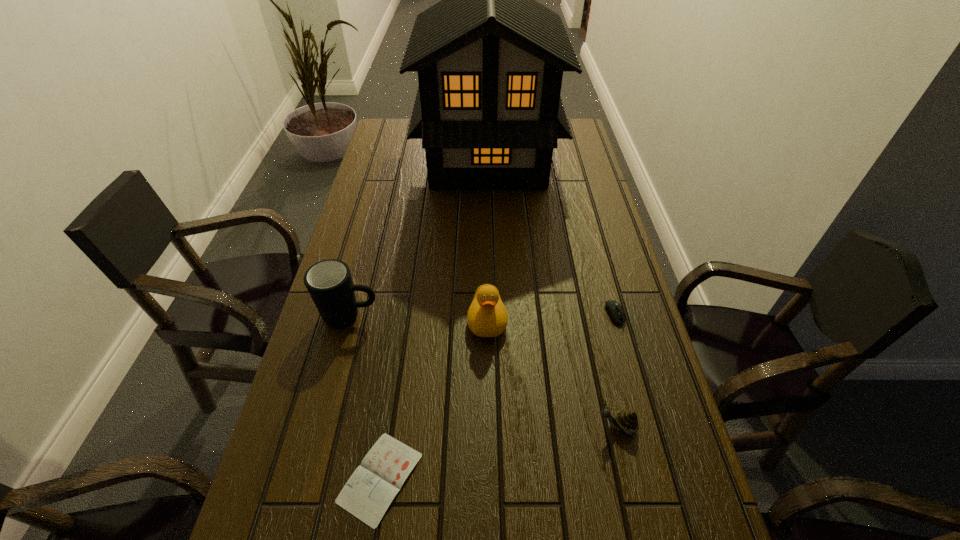
Where is `dollhouse`? This screenshot has width=960, height=540. dollhouse is located at coordinates (490, 59).

Where is `the tallest object`? the tallest object is located at coordinates (490, 59).

The height and width of the screenshot is (540, 960). Find the location of `the fifth shortest object`. the fifth shortest object is located at coordinates (329, 283).

What are the coordinates of `duck` in the screenshot? It's located at (487, 316).

Identify the location of the third shortest object. (627, 421).

The height and width of the screenshot is (540, 960). I want to click on computer mouse, so coord(614,309).

This screenshot has height=540, width=960. Identify the location of the shortest object. (370, 490).

Find the location of a particular element. free space located 0.130m on the front-facing side of the dollhouse is located at coordinates (384, 158).

Find the location of a particular element. free spot located 0.130m on the front-facing side of the dollhouse is located at coordinates (384, 158).

In order to click on vacant space located on the side of the mug with the handle in this screenshot , I will do (x=463, y=316).